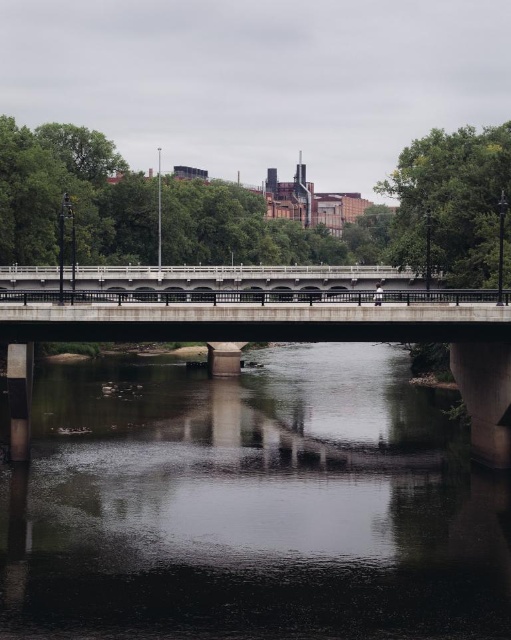
Question: Estimate the real-world distances between objects in this image. Which object is closer to the white concrete bridge at center?

Choices:
 (A) dark gray concrete river at center
 (B) concrete bridge at center

Answer: (B)

Question: Based on their relative distances, which object is farther from the white concrete bridge at center?

Choices:
 (A) dark gray concrete river at center
 (B) concrete bridge at center

Answer: (A)

Question: Which of the following is the closest to the observer?

Choices:
 (A) (313, 388)
 (B) (290, 291)
 (C) (364, 321)

Answer: (C)

Question: Does dark gray concrete river at center have a lesser width compared to white concrete bridge at center?

Choices:
 (A) yes
 (B) no

Answer: (A)

Question: Does dark gray concrete river at center appear under white concrete bridge at center?

Choices:
 (A) yes
 (B) no

Answer: (A)

Question: Can you confirm if concrete bridge at center is positioned to the left of white concrete bridge at center?

Choices:
 (A) no
 (B) yes

Answer: (A)